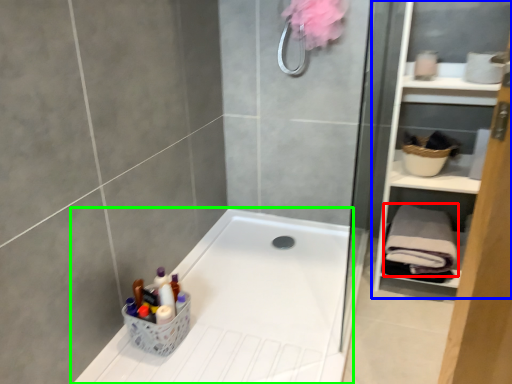
Question: Estimate the real-world distances between objects in this image. Which object is farther from bath towel (highlighted by a red box), cabinet (highlighted by a blue box) or bathtub (highlighted by a green box)?

Choices:
 (A) cabinet
 (B) bathtub

Answer: (B)